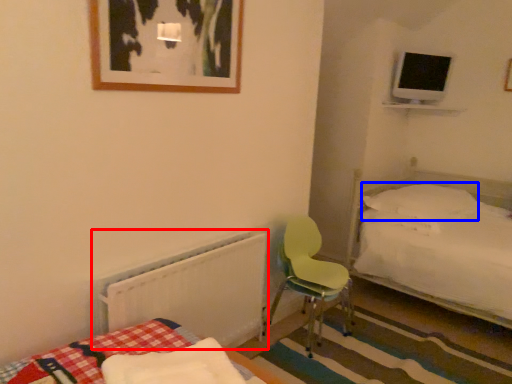
Question: Which point is closer to the camera, radiator (highlighted by a red box) or pillow (highlighted by a blue box)?

Choices:
 (A) radiator
 (B) pillow

Answer: (A)